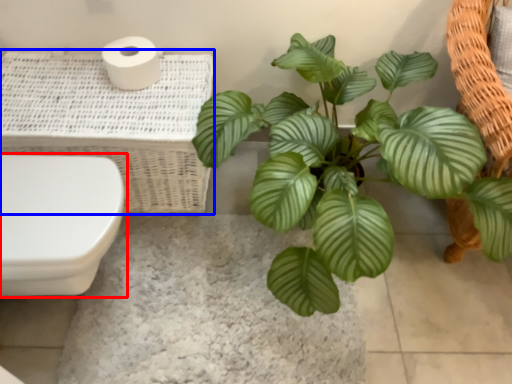
Question: Which point is further to the camera, toilet (highlighted by a red box) or basket (highlighted by a blue box)?

Choices:
 (A) toilet
 (B) basket

Answer: (B)